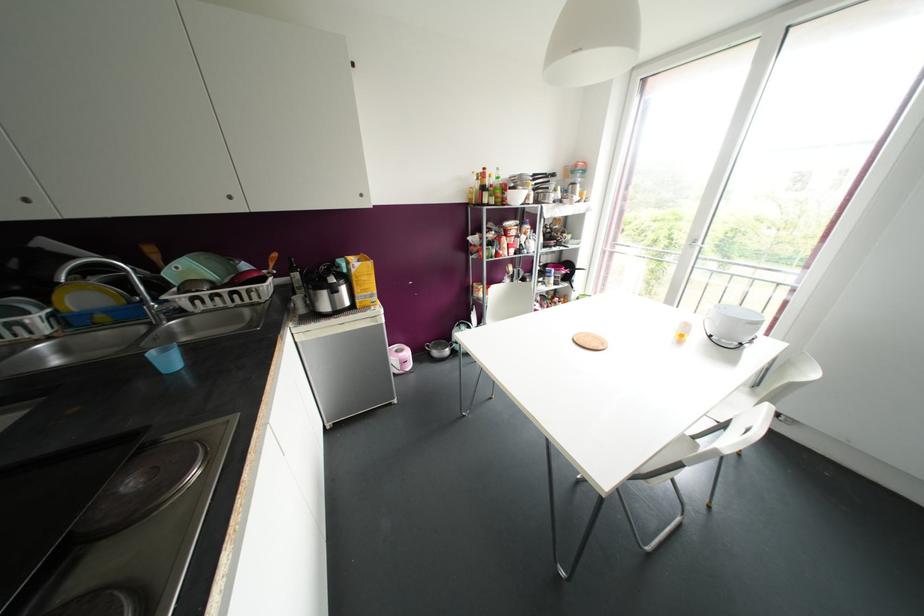
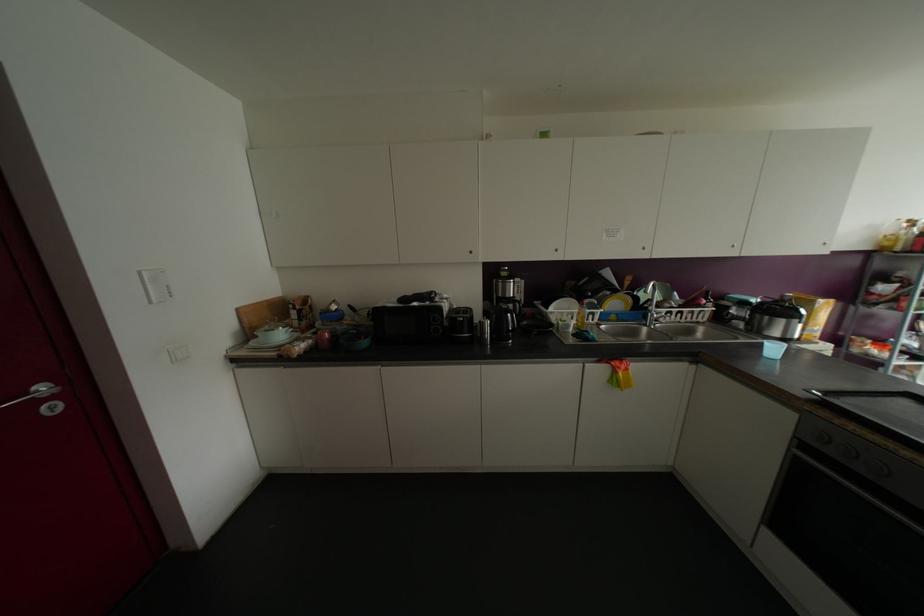
In the second image, find the point that corresponds to the point at 220,305 in the first image.

(677, 318)